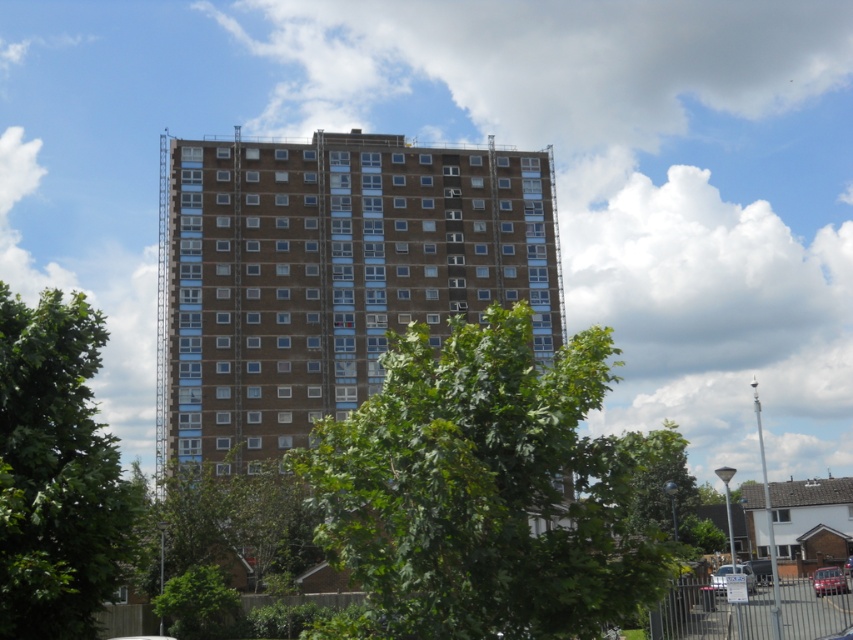
You are a city planner reviewing this area. You need to determine if the green leafy tree at left can block the view of the silver metallic car at lower right from the building. Based on their sizes, what do you think?

The green leafy tree at left is smaller than the silver metallic car at lower right. Since the tree is smaller, it is unlikely to block the view of the car from the building.

You are standing at the point where the green leafy tree at lower left is located at point (200, 605). Looking towards the residential highrise building, which direction would you face?

You would face north because the green leafy tree at lower left is located at point (200, 605), which is to the south of the building. Facing the building from this position would require facing north.

You are a city planner reviewing this area. You need to ensure that the metallic silver car at center does not block the view of the brown brick building at center from the nearby park. Based on their heights, can the car be placed directly in front of the building without obstructing the view?

The brown brick building at center has a greater height compared to the metallic silver car at center, so placing the car in front would not block the view of the building from the park since the building is taller.